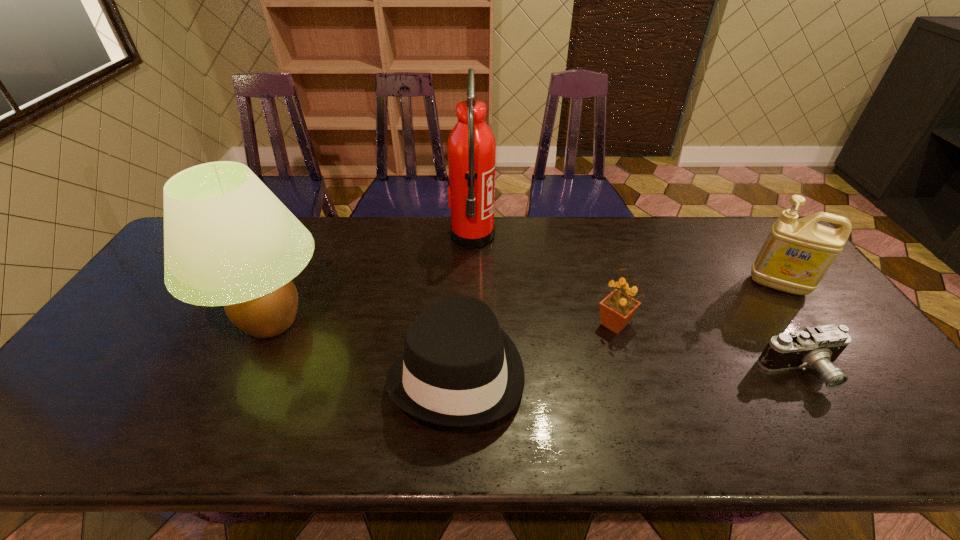
The image size is (960, 540). Find the location of `empty space between the leftmost object and the detergent`. empty space between the leftmost object and the detergent is located at coordinates (524, 303).

Identify the location of vacant point located between the lampshade and the third tallest object. (524, 303).

Find the location of a particular element. free space between the fedora and the camera is located at coordinates (630, 372).

Identify the location of free space between the fire extinguisher and the fifth shortest object. The height and width of the screenshot is (540, 960). (372, 279).

This screenshot has width=960, height=540. I want to click on empty location between the fedora and the fifth shortest object, so click(x=365, y=347).

Image resolution: width=960 pixels, height=540 pixels. Identify the location of free point between the fire extinguisher and the third object from right to left. (543, 280).

In order to click on object that is the fourth closest to the second tallest object in this screenshot , I will do `click(818, 347)`.

Where is `the fourth closest object relative to the fedora`? the fourth closest object relative to the fedora is located at coordinates (818, 347).

The height and width of the screenshot is (540, 960). In order to click on free location that satisfies the following two spatial constraints: 1. on the label side of the farthest object; 2. on the left side of the fourth shortest object in this screenshot , I will do `click(471, 285)`.

Where is `vacant point that satisfies the following two spatial constraints: 1. on the label side of the third tallest object; 2. on the left side of the farthest object`? vacant point that satisfies the following two spatial constraints: 1. on the label side of the third tallest object; 2. on the left side of the farthest object is located at coordinates (471, 285).